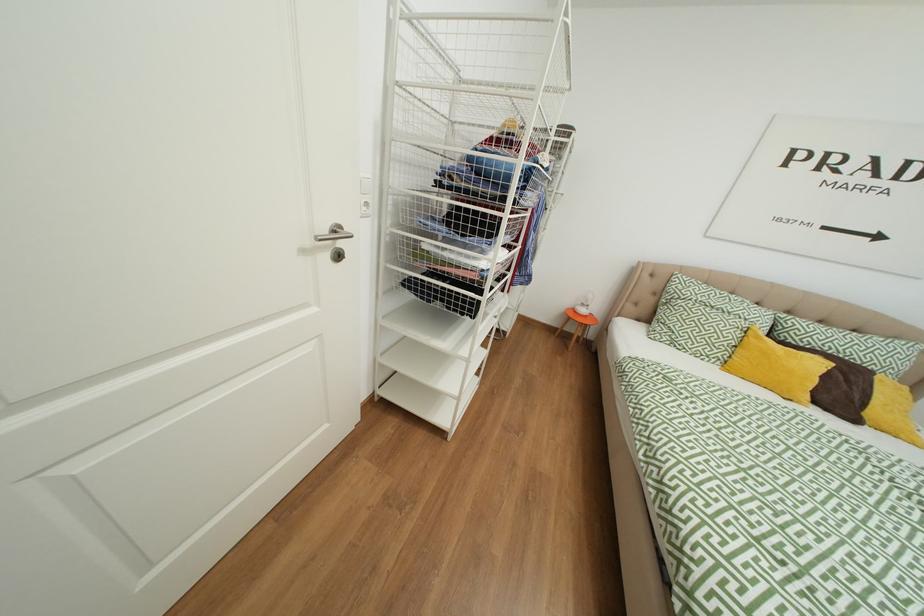
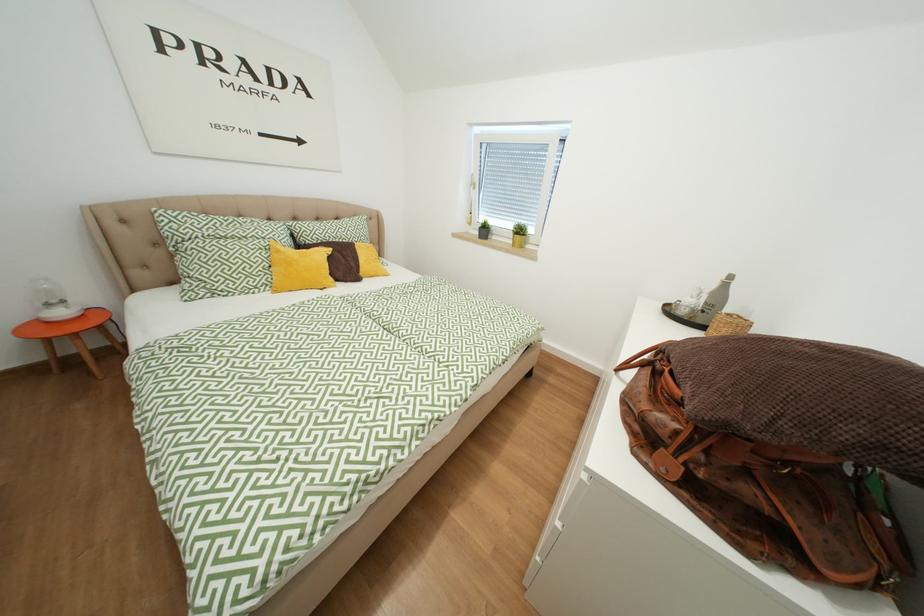
Based on the continuous images, in which direction is the camera rotating?

The rotation direction of the camera is right-down.